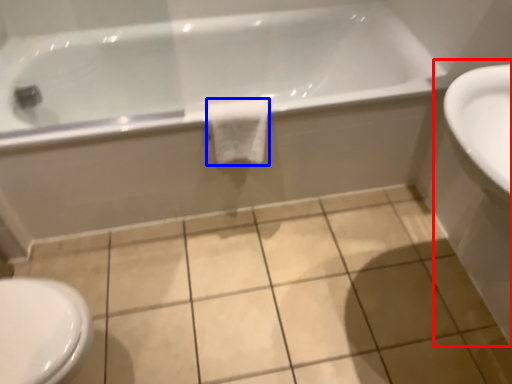
Question: Which point is closer to the camera, sink (highlighted by a red box) or bath towel (highlighted by a blue box)?

Choices:
 (A) sink
 (B) bath towel

Answer: (A)